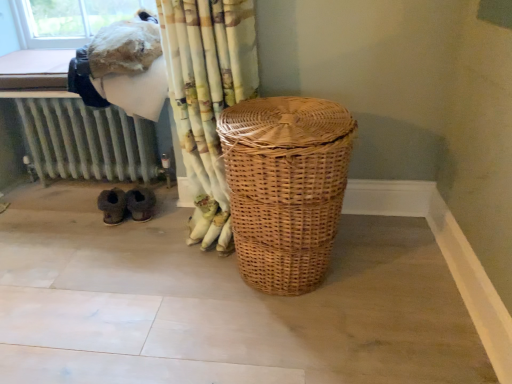
The height and width of the screenshot is (384, 512). What do you see at coordinates (207, 97) in the screenshot?
I see `patterned fabric curtain at center` at bounding box center [207, 97].

Measure the distance between point (142, 207) and camera.

5.94 feet.

I want to click on woven brown laundry basket at center, so click(x=285, y=187).

Identify the location of metallic radiator at lower left. Image resolution: width=512 pixels, height=384 pixels. (87, 141).

Considering the positions of objects brown suede slippers at lower left and patterned fabric curtain at center in the image provided, who is more to the left, brown suede slippers at lower left or patterned fabric curtain at center?

brown suede slippers at lower left is more to the left.

Considering the positions of points (118, 218) and (226, 195), is point (118, 218) farther from camera compared to point (226, 195)?

Yes, it is.

Is patterned fabric curtain at center at the back of brown suede slippers at lower left?

No, brown suede slippers at lower left is not facing the opposite direction of patterned fabric curtain at center.

In the scene shown: Is brown suede slippers at lower left at the back of patterned fabric curtain at center?

That's not correct — patterned fabric curtain at center is not looking away from brown suede slippers at lower left.

Considering the sizes of objects patterned fabric curtain at center and brown suede slippers at lower left in the image provided, who is shorter, patterned fabric curtain at center or brown suede slippers at lower left?

With less height is brown suede slippers at lower left.

Locate an element on the screen. This screenshot has width=512, height=384. footwear that appears below the patterned fabric curtain at center (from a real-world perspective) is located at coordinates (126, 204).

Considering the relative sizes of patterned fabric curtain at center and brown suede slippers at lower left in the image provided, is patterned fabric curtain at center wider than brown suede slippers at lower left?

Correct, the width of patterned fabric curtain at center exceeds that of brown suede slippers at lower left.

How different are the orientations of woven brown laundry basket at center and patterned fabric curtain at center in degrees?

They differ by 0.42 degrees in their facing directions.

From the image's perspective, which one is positioned higher, woven brown laundry basket at center or patterned fabric curtain at center?

patterned fabric curtain at center, from the image's perspective.

Is patterned fabric curtain at center surrounded by woven brown laundry basket at center?

That's incorrect, patterned fabric curtain at center is not inside woven brown laundry basket at center.

Where is `laundry basket lying in front of the patterned fabric curtain at center`? laundry basket lying in front of the patterned fabric curtain at center is located at coordinates (285, 187).

Considering the positions of objects patterned fabric curtain at center and metallic radiator at lower left in the image provided, who is in front, patterned fabric curtain at center or metallic radiator at lower left?

patterned fabric curtain at center is in front.

Is patterned fabric curtain at center positioned far away from metallic radiator at lower left?

No, patterned fabric curtain at center is not far away from metallic radiator at lower left.

Between patterned fabric curtain at center and metallic radiator at lower left, which one has smaller size?

metallic radiator at lower left is smaller.

Which is in front, woven brown laundry basket at center or metallic radiator at lower left?

woven brown laundry basket at center is in front.

Does woven brown laundry basket at center touch metallic radiator at lower left?

No, woven brown laundry basket at center is not with metallic radiator at lower left.

Looking at this image, how different are the orientations of woven brown laundry basket at center and metallic radiator at lower left in degrees?

The facing directions of woven brown laundry basket at center and metallic radiator at lower left are 90.3 degrees apart.

Who is bigger, woven brown laundry basket at center or metallic radiator at lower left?

woven brown laundry basket at center is bigger.

Is metallic radiator at lower left outside of patterned fabric curtain at center?

Yes, metallic radiator at lower left is not within patterned fabric curtain at center.

From the image's perspective, which is below, metallic radiator at lower left or patterned fabric curtain at center?

metallic radiator at lower left.

Based on their sizes in the image, would you say metallic radiator at lower left is bigger or smaller than patterned fabric curtain at center?

Considering their sizes, metallic radiator at lower left takes up less space than patterned fabric curtain at center.

Is brown suede slippers at lower left oriented towards woven brown laundry basket at center?

No, brown suede slippers at lower left is not oriented towards woven brown laundry basket at center.

Is brown suede slippers at lower left positioned before woven brown laundry basket at center?

No, it is not.

Is brown suede slippers at lower left wider or thinner than woven brown laundry basket at center?

Clearly, brown suede slippers at lower left has less width compared to woven brown laundry basket at center.

Which object is positioned more to the left, brown suede slippers at lower left or woven brown laundry basket at center?

Positioned to the left is brown suede slippers at lower left.

You are a GUI agent. You are given a task and a screenshot of the screen. Output one action in this format:
    pyautogui.click(x=<x>, y=<y>)
    Task: Click on the curtain that is on the right side of brown suede slippers at lower left
    The image size is (512, 384).
    Given the screenshot: What is the action you would take?
    pyautogui.click(x=207, y=97)

I want to click on curtain above the brown suede slippers at lower left (from a real-world perspective), so click(207, 97).

When comparing their distances from patterned fabric curtain at center, does metallic radiator at lower left or woven brown laundry basket at center seem further?

Among the two, metallic radiator at lower left is located further to patterned fabric curtain at center.

Based on the photo, based on their spatial positions, is brown suede slippers at lower left or woven brown laundry basket at center closer to patterned fabric curtain at center?

Among the two, woven brown laundry basket at center is located nearer to patterned fabric curtain at center.

In the scene shown: Looking at the image, which one is located further to patterned fabric curtain at center, metallic radiator at lower left or brown suede slippers at lower left?

metallic radiator at lower left is positioned further to the anchor patterned fabric curtain at center.

Considering their positions, is patterned fabric curtain at center positioned further to woven brown laundry basket at center than metallic radiator at lower left?

metallic radiator at lower left is positioned further to the anchor woven brown laundry basket at center.

From the image, which object appears to be nearer to patterned fabric curtain at center, woven brown laundry basket at center or metallic radiator at lower left?

woven brown laundry basket at center lies closer to patterned fabric curtain at center than the other object.

When comparing their distances from metallic radiator at lower left, does patterned fabric curtain at center or brown suede slippers at lower left seem further?

patterned fabric curtain at center is further to metallic radiator at lower left.

Considering their positions, is metallic radiator at lower left positioned closer to brown suede slippers at lower left than woven brown laundry basket at center?

metallic radiator at lower left is closer to brown suede slippers at lower left.

Which object lies further to the anchor point woven brown laundry basket at center, brown suede slippers at lower left or patterned fabric curtain at center?

brown suede slippers at lower left.

The image size is (512, 384). I want to click on curtain between metallic radiator at lower left and woven brown laundry basket at center, so click(207, 97).

In order to click on curtain between woven brown laundry basket at center and brown suede slippers at lower left in the front-back direction in this screenshot , I will do `click(207, 97)`.

Where is `footwear located between patterned fabric curtain at center and metallic radiator at lower left in the depth direction`? The image size is (512, 384). footwear located between patterned fabric curtain at center and metallic radiator at lower left in the depth direction is located at coordinates (126, 204).

Image resolution: width=512 pixels, height=384 pixels. In order to click on footwear between metallic radiator at lower left and woven brown laundry basket at center in this screenshot , I will do `click(126, 204)`.